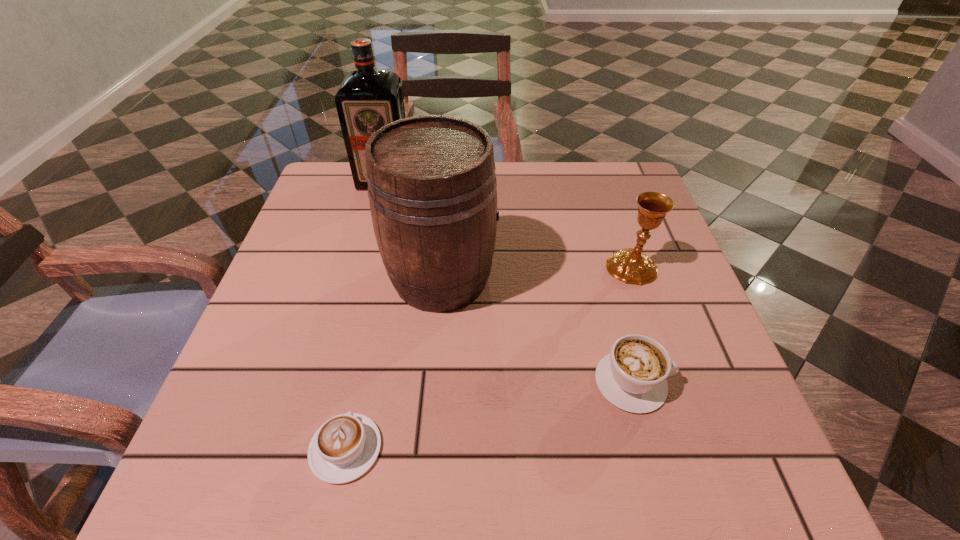
What are the coordinates of `vacant space located to the right of the taller cappuccino's handle` in the screenshot? It's located at (733, 382).

Find the location of `free spot located 0.110m with the handle on the right side of the nearer cappuccino`. free spot located 0.110m with the handle on the right side of the nearer cappuccino is located at coordinates (365, 357).

The width and height of the screenshot is (960, 540). Identify the location of vacant space located 0.360m with the handle on the right side of the nearer cappuccino. (386, 261).

At what (x,y) coordinates should I click in order to perform the action: click on vacant space located 0.280m with the handle on the right side of the nearer cappuccino. Please return your answer as a coordinate pair (x, y). The width and height of the screenshot is (960, 540). Looking at the image, I should click on (380, 288).

Find the location of `object at the far edge`. object at the far edge is located at coordinates point(366,100).

Identify the location of object present at the near edge. This screenshot has width=960, height=540. (345, 447).

Where is `object positioned at the left edge`? Image resolution: width=960 pixels, height=540 pixels. object positioned at the left edge is located at coordinates (366, 100).

Locate an element on the screen. chalice situated at the right edge is located at coordinates (629, 265).

The height and width of the screenshot is (540, 960). Find the location of `cappuccino at the right edge`. cappuccino at the right edge is located at coordinates (632, 377).

Where is `object situated at the far left corner`? This screenshot has height=540, width=960. object situated at the far left corner is located at coordinates (366, 100).